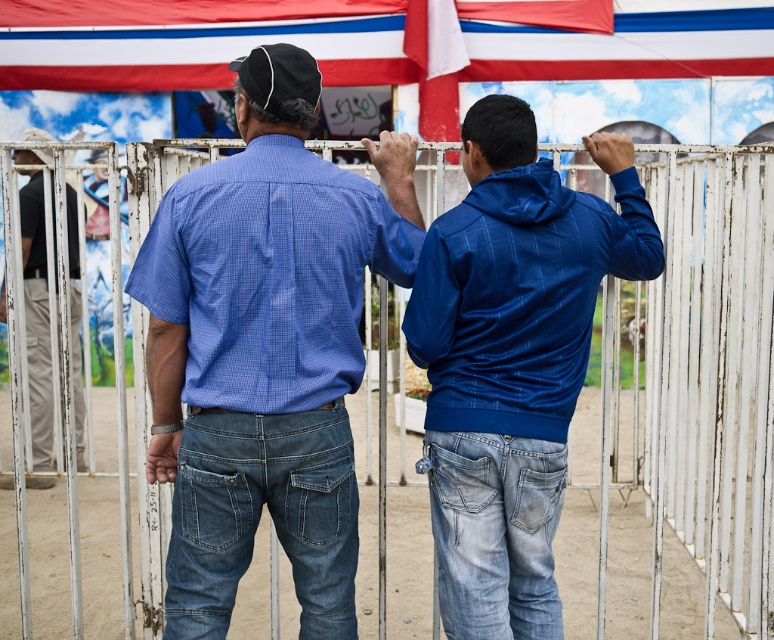
Measure the distance between point (x=298, y=348) and camera.

They are 15.66 feet apart.

Is point (139, 284) in front of point (26, 161)?

Yes, it is.

At what (x,y) coordinates should I click in order to perform the action: click on blue checkered shirt at center. Please return your answer as a coordinate pair (x, y). Looking at the image, I should click on (269, 273).

Is matte blue shirt at center below black fabric baseball cap at upper center?

Indeed, matte blue shirt at center is positioned under black fabric baseball cap at upper center.

Between matte blue shirt at center and black fabric baseball cap at upper center, which one appears on the left side from the viewer's perspective?

matte blue shirt at center

The image size is (774, 640). In order to click on matte blue shirt at center in this screenshot , I will do `click(265, 358)`.

Where is `matte blue shirt at center`? matte blue shirt at center is located at coordinates (265, 358).

Can you confirm if blue pinstriped hoodie at center is thinner than khaki pants at left?

Incorrect, blue pinstriped hoodie at center's width is not less than khaki pants at left's.

Does point (587, 147) lie behind point (43, 410)?

No, (587, 147) is in front of (43, 410).

In order to click on blue pinstriped hoodie at center in this screenshot , I will do `click(512, 358)`.